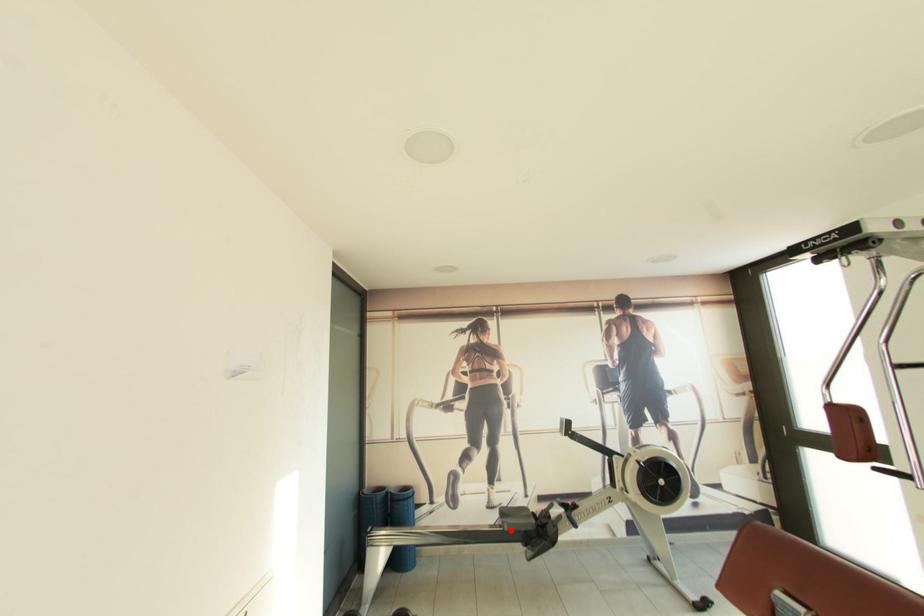
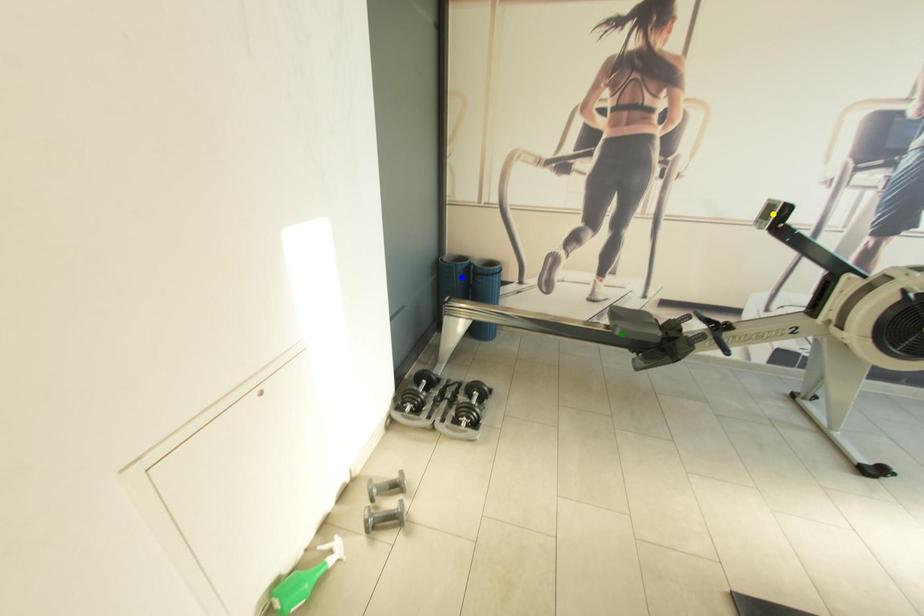
Question: I am providing you with two images of the same scene from different viewpoints. A red point is marked on the first image. You are given multiple points on the second image. Which point in image 2 is actually the same real-world point as the red point in image 1?

Choices:
 (A) green point
 (B) yellow point
 (C) blue point

Answer: (A)